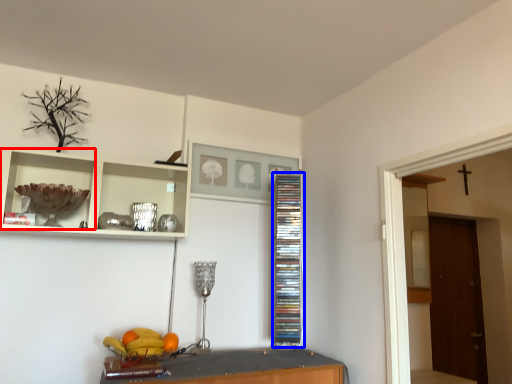
Question: Which of the following is the closest to the observer, cabinet (highlighted by a red box) or cabinet (highlighted by a blue box)?

Choices:
 (A) cabinet
 (B) cabinet

Answer: (A)